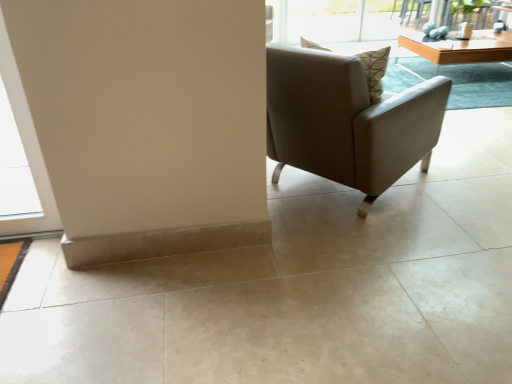
Question: Should I look upward or downward to see light brown wooden table at upper right?

Choices:
 (A) down
 (B) up

Answer: (B)

Question: Is light brown wooden table at upper right positioned far away from matte gray armchair at center?

Choices:
 (A) yes
 (B) no

Answer: (A)

Question: Considering the relative sizes of light brown wooden table at upper right and matte gray armchair at center in the image provided, is light brown wooden table at upper right shorter than matte gray armchair at center?

Choices:
 (A) yes
 (B) no

Answer: (A)

Question: Does light brown wooden table at upper right have a larger size compared to matte gray armchair at center?

Choices:
 (A) no
 (B) yes

Answer: (A)

Question: Is light brown wooden table at upper right surrounding matte gray armchair at center?

Choices:
 (A) no
 (B) yes

Answer: (A)

Question: From a real-world perspective, does light brown wooden table at upper right sit lower than matte gray armchair at center?

Choices:
 (A) yes
 (B) no

Answer: (A)

Question: Is light brown wooden table at upper right further to camera compared to matte gray armchair at center?

Choices:
 (A) yes
 (B) no

Answer: (A)

Question: Is light brown wooden table at upper right surrounded by matte gray armchair at center?

Choices:
 (A) yes
 (B) no

Answer: (B)

Question: From a real-world perspective, is matte gray armchair at center positioned under light brown wooden table at upper right based on gravity?

Choices:
 (A) yes
 (B) no

Answer: (B)

Question: Considering the relative positions of matte gray armchair at center and light brown wooden table at upper right in the image provided, is matte gray armchair at center to the right of light brown wooden table at upper right from the viewer's perspective?

Choices:
 (A) yes
 (B) no

Answer: (B)

Question: Does matte gray armchair at center have a greater height compared to light brown wooden table at upper right?

Choices:
 (A) no
 (B) yes

Answer: (B)

Question: From the image's perspective, is matte gray armchair at center on light brown wooden table at upper right?

Choices:
 (A) no
 (B) yes

Answer: (A)

Question: Considering the relative positions of matte gray armchair at center and light brown wooden table at upper right in the image provided, is matte gray armchair at center in front of light brown wooden table at upper right?

Choices:
 (A) yes
 (B) no

Answer: (A)

Question: From the image's perspective, is light brown wooden table at upper right positioned above or below matte gray armchair at center?

Choices:
 (A) above
 (B) below

Answer: (A)